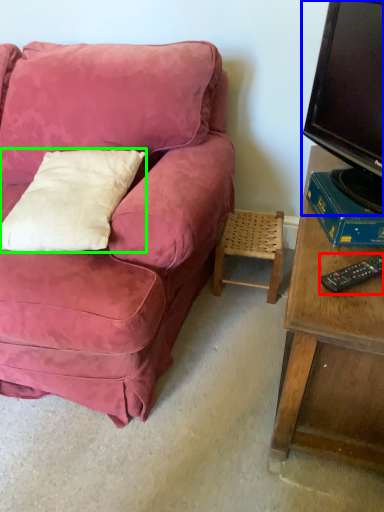
Question: Estimate the real-world distances between objects in this image. Which object is farther from remote control (highlighted by a red box), television (highlighted by a blue box) or pillow (highlighted by a green box)?

Choices:
 (A) television
 (B) pillow

Answer: (B)